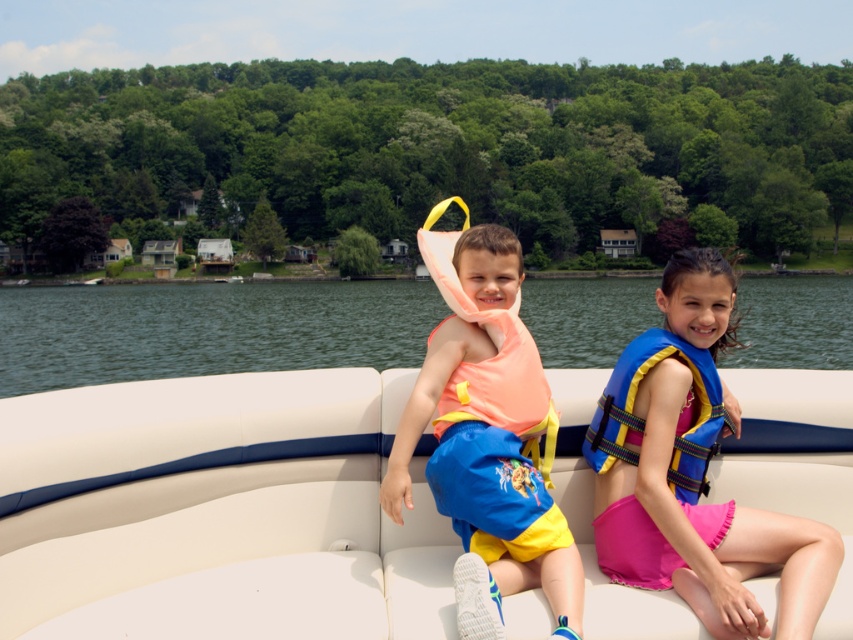
Consider the image. You are standing at point (126,566) and want to take a photo of the children on the boat. The camera you have can focus on subjects up to 15 feet away. Will the camera be able to capture the children clearly?

The distance between point (126,566) and the camera is 14.94 feet, which is within the camera focus range of 15 feet. Therefore, the camera can capture the children clearly.